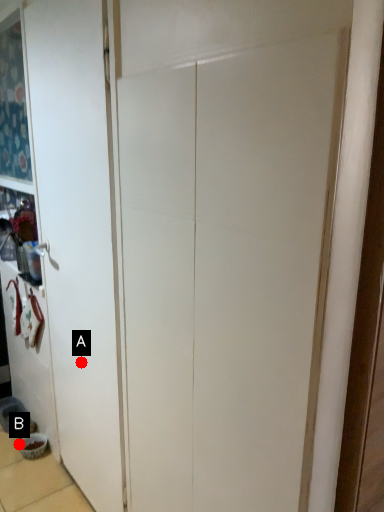
Question: Two points are circled on the image, labeled by A and B beside each circle. Which point appears farthest from the camera in this image?

Choices:
 (A) A is further
 (B) B is further

Answer: (B)